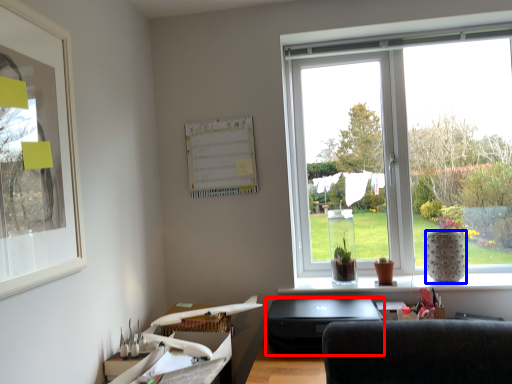
Question: Among these objects, which one is farthest to the camera, desktop (highlighted by a red box) or vase (highlighted by a blue box)?

Choices:
 (A) desktop
 (B) vase

Answer: (B)